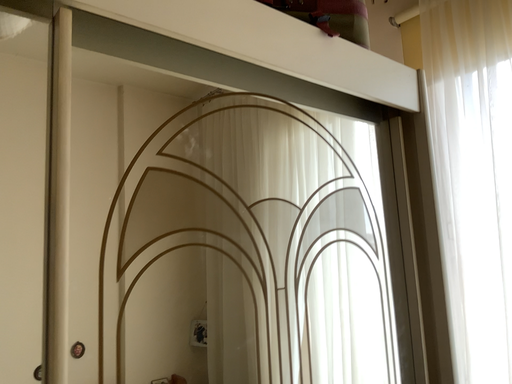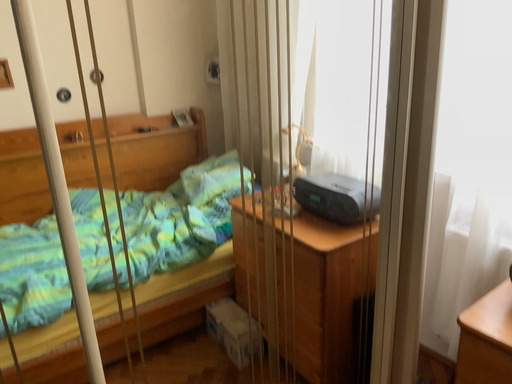
Question: Which way did the camera rotate in the video?

Choices:
 (A) rotated downward
 (B) rotated upward

Answer: (A)